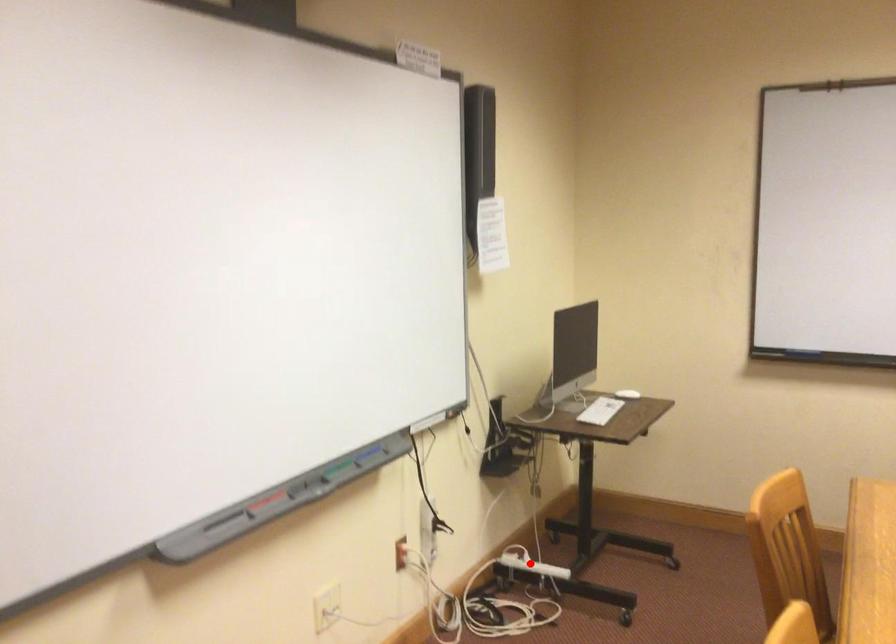
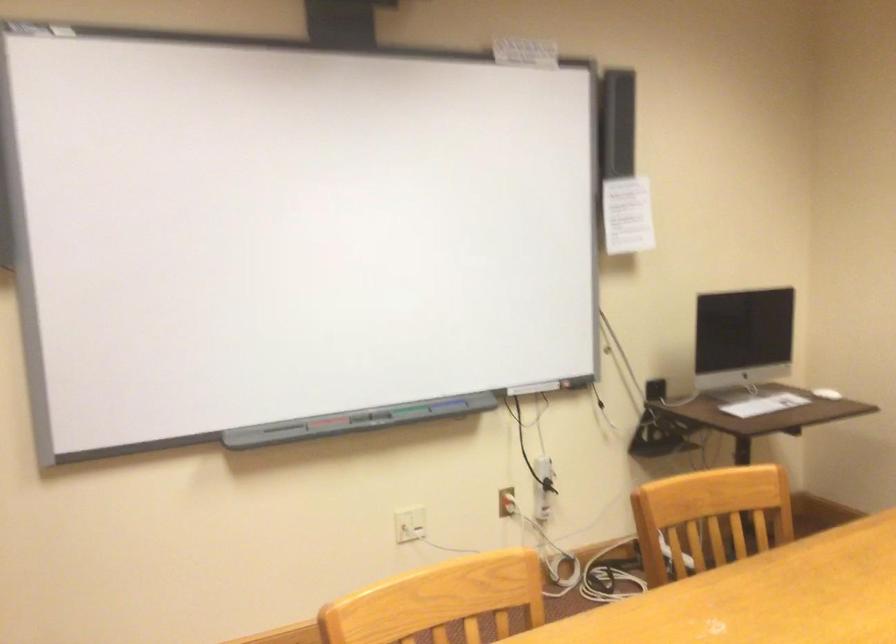
Question: I am providing you with two images of the same scene from different viewpoints. A red point is marked on the first image. Can you still see the location of the red point in image 2?

Choices:
 (A) Yes
 (B) No

Answer: (B)